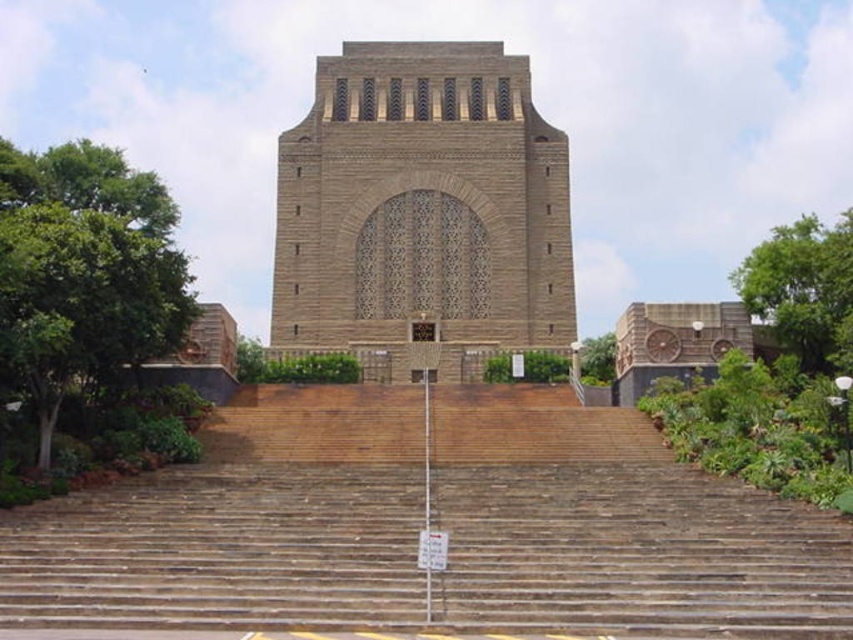
You are planning to place a small bench in the scene. Given the space occupied by the brown wooden stairs at center and the green leafy tree at right, which object would allow more space for the bench to be placed nearby?

The green leafy tree at right occupies more space than the brown wooden stairs at center, so placing the bench near the green leafy tree at right would allow more space for the bench.

Based on the photo, you are standing at the base of the monument and want to approach the green leafy tree at right. Which direction should you move relative to the brown wooden stairs at center?

You should move to the right of the brown wooden stairs at center to reach the green leafy tree at right.